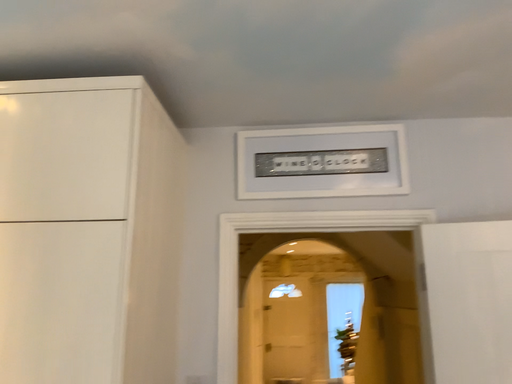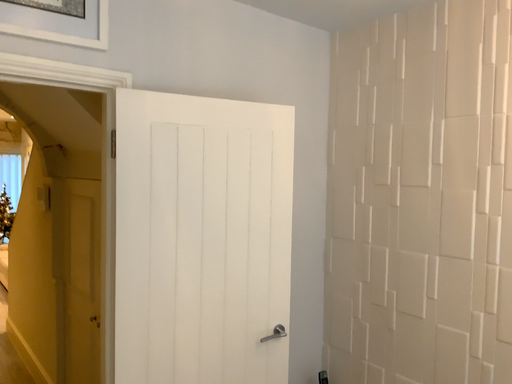
Question: How did the camera likely rotate when shooting the video?

Choices:
 (A) rotated downward
 (B) rotated upward

Answer: (A)